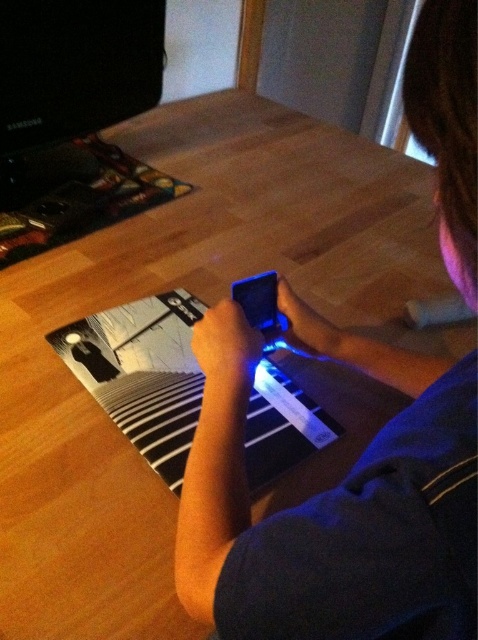
From the picture: Who is more distant from viewer, (251,540) or (105,385)?

Positioned behind is point (105,385).

Which is in front, point (426, 477) or point (136, 403)?

Point (426, 477) is in front.

At what (x,y) coordinates should I click in order to perform the action: click on blue matte phone at center. Please return your answer as a coordinate pair (x, y). This screenshot has height=640, width=478. Looking at the image, I should click on (334, 500).